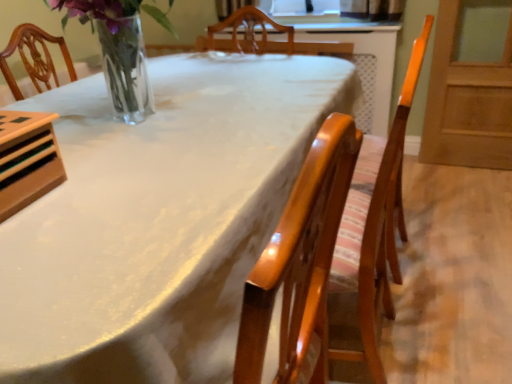
Question: From a real-world perspective, is white glossy table at center positioned above or below glossy wood chair at center?

Choices:
 (A) below
 (B) above

Answer: (A)

Question: Is white glossy table at center inside or outside of glossy wood chair at center?

Choices:
 (A) outside
 (B) inside

Answer: (A)

Question: In terms of width, does white glossy table at center look wider or thinner when compared to glossy wood chair at center?

Choices:
 (A) thin
 (B) wide

Answer: (B)

Question: Does point (374, 339) appear closer or farther from the camera than point (9, 238)?

Choices:
 (A) farther
 (B) closer

Answer: (A)

Question: Considering the positions of glossy wood chair at center and white glossy table at center in the image, is glossy wood chair at center taller or shorter than white glossy table at center?

Choices:
 (A) tall
 (B) short

Answer: (A)

Question: In the image, is glossy wood chair at center positioned in front of or behind white glossy table at center?

Choices:
 (A) front
 (B) behind

Answer: (B)

Question: Looking at the image, does glossy wood chair at center seem bigger or smaller compared to white glossy table at center?

Choices:
 (A) small
 (B) big

Answer: (A)